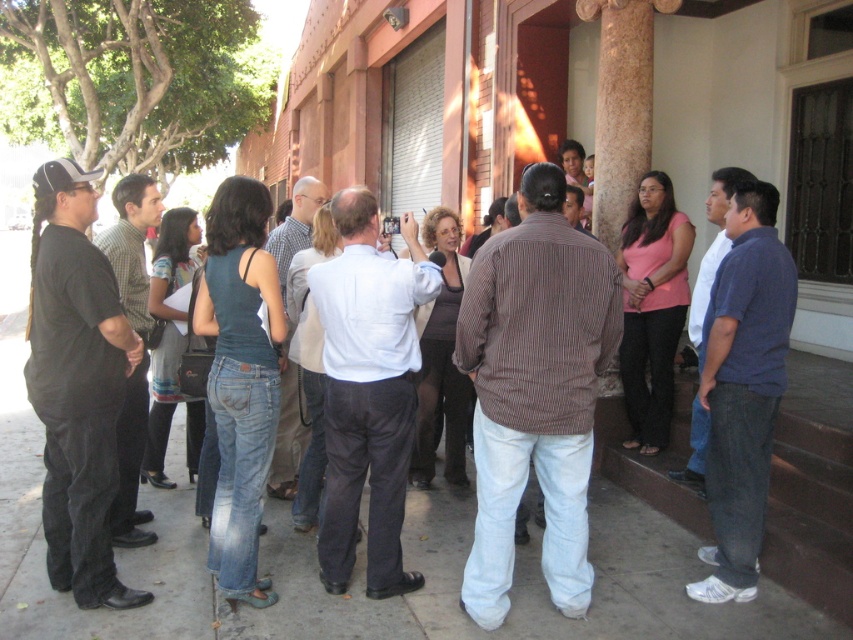
Between light blue shirt at center and blue jeans at right, which one appears on the left side from the viewer's perspective?

Positioned to the left is light blue shirt at center.

Does light blue shirt at center have a lesser width compared to blue jeans at right?

No, light blue shirt at center is not thinner than blue jeans at right.

You are a GUI agent. You are given a task and a screenshot of the screen. Output one action in this format:
    pyautogui.click(x=<x>, y=<y>)
    Task: Click on the light blue shirt at center
    This screenshot has width=853, height=640.
    Given the screenshot: What is the action you would take?
    pyautogui.click(x=368, y=390)

This screenshot has width=853, height=640. I want to click on light blue shirt at center, so click(x=368, y=390).

Does light blue shirt at center appear on the left side of checkered fabric shirt at center?

No, light blue shirt at center is not to the left of checkered fabric shirt at center.

Is point (364, 200) less distant than point (312, 209)?

Yes, it is.

You are a GUI agent. You are given a task and a screenshot of the screen. Output one action in this format:
    pyautogui.click(x=<x>, y=<y>)
    Task: Click on the light blue shirt at center
    This screenshot has height=640, width=853.
    Given the screenshot: What is the action you would take?
    pyautogui.click(x=368, y=390)

Is the position of brown striped shirt at center less distant than that of checkered fabric shirt at center?

Yes.

Does brown striped shirt at center have a lesser height compared to checkered fabric shirt at center?

Yes.

Looking at this image, who is more distant from viewer, (482, 524) or (280, 232)?

The point (280, 232) is more distant.

The width and height of the screenshot is (853, 640). What are the coordinates of `brown striped shirt at center` in the screenshot? It's located at (534, 392).